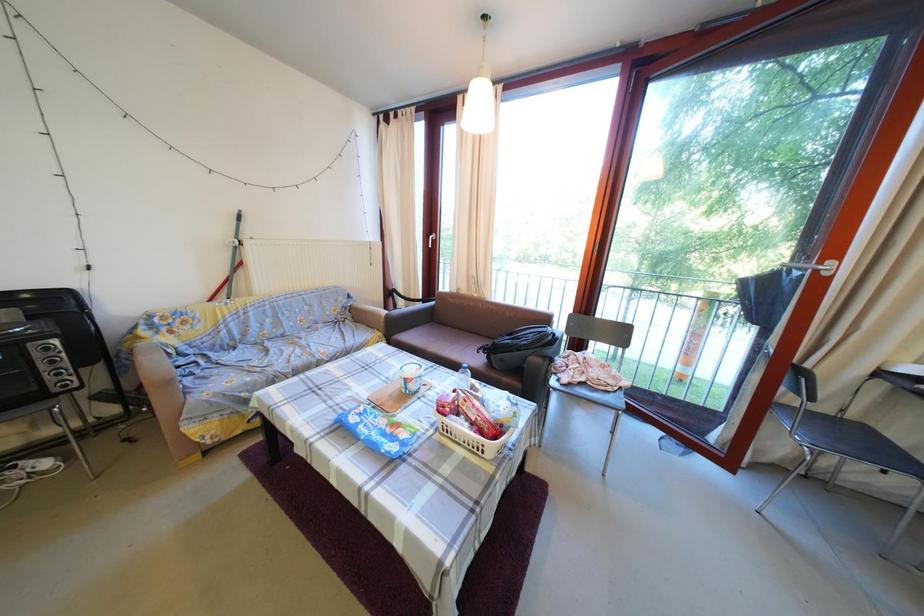
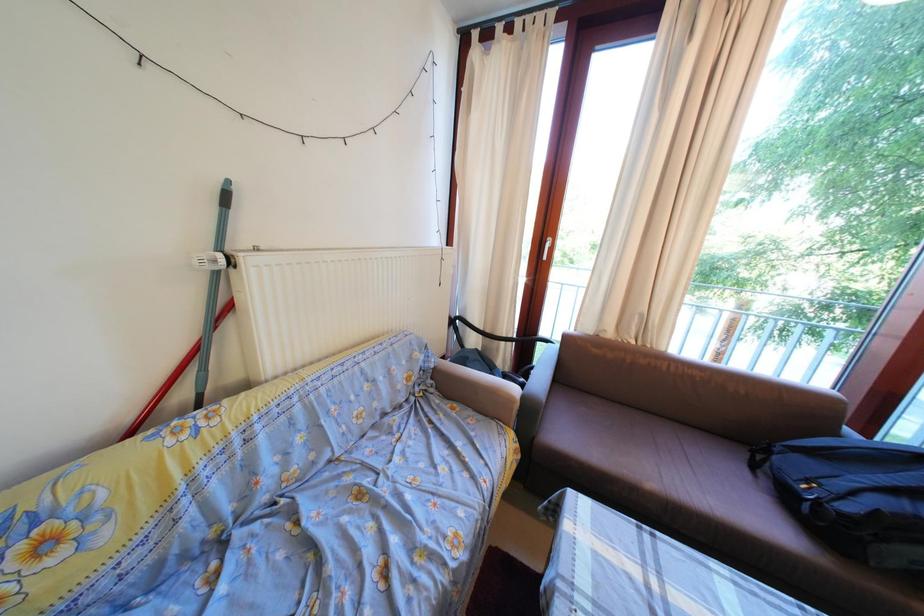
Which direction would the cameraman need to move to produce the second image?

The movement direction of the cameraman is left, forward.